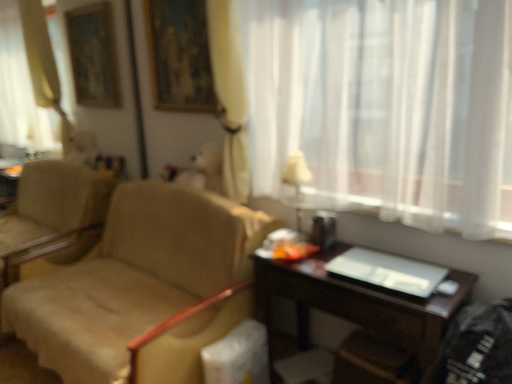
What do you see at coordinates (372, 105) in the screenshot?
I see `white sheer curtain at upper right` at bounding box center [372, 105].

This screenshot has height=384, width=512. I want to click on dark wood desk at lower right, so click(356, 301).

What do you see at coordinates (356, 301) in the screenshot?
I see `dark wood desk at lower right` at bounding box center [356, 301].

I want to click on white plastic laptop at right, so click(x=388, y=272).

In order to face white fabric lampshade at upper center, should I rotate leftwards or rightwards?

Turn right by 5.519 degrees to look at white fabric lampshade at upper center.

What are the coordinates of `beige fabric chair at left` in the screenshot? It's located at (142, 287).

Is point (294, 152) positioned behind point (157, 78)?

No, it is not.

This screenshot has width=512, height=384. In order to click on table lamp below the wooden picture frame at upper center (from a real-world perspective) in this screenshot , I will do `click(297, 171)`.

Can you tell me how much white fabric lampshade at upper center and wooden picture frame at upper center differ in facing direction?

The facing directions of white fabric lampshade at upper center and wooden picture frame at upper center are 0.904 degrees apart.

Which is behind, white plastic laptop at right or beige fabric chair at left?

white plastic laptop at right is further away from the camera.

Considering the relative sizes of white plastic laptop at right and beige fabric chair at left in the image provided, is white plastic laptop at right wider than beige fabric chair at left?

Incorrect, the width of white plastic laptop at right does not surpass that of beige fabric chair at left.

Is white plastic laptop at right positioned with its back to beige fabric chair at left?

No, beige fabric chair at left is not at the back of white plastic laptop at right.

Does point (432, 281) come in front of point (144, 286)?

Yes, it is.

Considering the relative sizes of dark wood desk at lower right and white fabric lampshade at upper center in the image provided, is dark wood desk at lower right taller than white fabric lampshade at upper center?

Yes, dark wood desk at lower right is taller than white fabric lampshade at upper center.

Looking at this image, from the image's perspective, is dark wood desk at lower right located above white fabric lampshade at upper center?

Incorrect, from the image's perspective, dark wood desk at lower right is lower than white fabric lampshade at upper center.

Between dark wood desk at lower right and white fabric lampshade at upper center, which one has smaller width?

white fabric lampshade at upper center.

Would you consider dark wood desk at lower right to be distant from white fabric lampshade at upper center?

They are positioned close to each other.

Is white plastic laptop at right turned away from wooden picture frame at upper center?

That's not correct — white plastic laptop at right is not looking away from wooden picture frame at upper center.

The width and height of the screenshot is (512, 384). In the image, there is a wooden picture frame at upper center. Find the location of `laptop below it (from the image's perspective)`. laptop below it (from the image's perspective) is located at coordinates (388, 272).

Is white plastic laptop at right taller or shorter than wooden picture frame at upper center?

Clearly, white plastic laptop at right is shorter compared to wooden picture frame at upper center.

Is white plastic laptop at right positioned beyond the bounds of wooden picture frame at upper center?

Yes.

Choose the correct answer: Is white fabric lampshade at upper center inside dark wood desk at lower right or outside it?

white fabric lampshade at upper center is not inside dark wood desk at lower right, it's outside.

Measure the distance between white fabric lampshade at upper center and dark wood desk at lower right.

white fabric lampshade at upper center is 21.17 inches away from dark wood desk at lower right.

From the image's perspective, is white fabric lampshade at upper center beneath dark wood desk at lower right?

Actually, white fabric lampshade at upper center appears above dark wood desk at lower right in the image.

This screenshot has width=512, height=384. What are the coordinates of `table lamp above the dark wood desk at lower right (from a real-world perspective)` in the screenshot? It's located at (297, 171).

Who is smaller, white sheer curtain at upper right or dark wood desk at lower right?

Smaller between the two is dark wood desk at lower right.

Consider the image. In terms of width, does white sheer curtain at upper right look wider or thinner when compared to dark wood desk at lower right?

In the image, white sheer curtain at upper right appears to be more narrow than dark wood desk at lower right.

Is white sheer curtain at upper right not near dark wood desk at lower right?

No, white sheer curtain at upper right is not far away from dark wood desk at lower right.

From the picture: Is dark wood desk at lower right a part of white sheer curtain at upper right?

No, white sheer curtain at upper right does not contain dark wood desk at lower right.

From a real-world perspective, is white sheer curtain at upper right physically below white plastic laptop at right?

Actually, white sheer curtain at upper right is physically above white plastic laptop at right in the real world.

Which is correct: white sheer curtain at upper right is inside white plastic laptop at right, or outside of it?

white sheer curtain at upper right exists outside the volume of white plastic laptop at right.

Is the position of white sheer curtain at upper right less distant than that of white plastic laptop at right?

Yes, it is in front of white plastic laptop at right.

Does white sheer curtain at upper right have a greater height compared to white plastic laptop at right?

Yes, white sheer curtain at upper right is taller than white plastic laptop at right.

Locate an element on the screen. picture frame that appears above the white fabric lampshade at upper center (from the image's perspective) is located at coordinates (179, 55).

Identify the location of chair on the left side of white plastic laptop at right. (142, 287).

From the picture: Which object lies nearer to the anchor point white fabric lampshade at upper center, white sheer curtain at upper right or dark wood desk at lower right?

The object closer to white fabric lampshade at upper center is white sheer curtain at upper right.

Estimate the real-world distances between objects in this image. Which object is closer to dark wood desk at lower right, white plastic laptop at right or white fabric lampshade at upper center?

Among the two, white plastic laptop at right is located nearer to dark wood desk at lower right.

From the image, which object appears to be farther from beige fabric chair at left, white plastic laptop at right or dark wood desk at lower right?

white plastic laptop at right is positioned further to the anchor beige fabric chair at left.

From the image, which object appears to be nearer to beige fabric chair at left, white sheer curtain at upper right or white fabric lampshade at upper center?

white sheer curtain at upper right is closer to beige fabric chair at left.

Considering their positions, is wooden picture frame at upper center positioned closer to dark wood desk at lower right than white fabric lampshade at upper center?

Based on the image, white fabric lampshade at upper center appears to be nearer to dark wood desk at lower right.

Looking at the image, which one is located further to white plastic laptop at right, dark wood desk at lower right or wooden picture frame at upper center?

wooden picture frame at upper center lies further to white plastic laptop at right than the other object.

Which object lies nearer to the anchor point beige fabric chair at left, wooden picture frame at upper center or white fabric lampshade at upper center?

Among the two, white fabric lampshade at upper center is located nearer to beige fabric chair at left.

Looking at the image, which one is located further to beige fabric chair at left, white fabric lampshade at upper center or wooden picture frame at upper center?

wooden picture frame at upper center is further to beige fabric chair at left.

The image size is (512, 384). Find the location of `table lamp between wooden picture frame at upper center and beige fabric chair at left in the up-down direction`. table lamp between wooden picture frame at upper center and beige fabric chair at left in the up-down direction is located at coordinates (297, 171).

This screenshot has height=384, width=512. Find the location of `laptop that lies between white sheer curtain at upper right and dark wood desk at lower right from top to bottom`. laptop that lies between white sheer curtain at upper right and dark wood desk at lower right from top to bottom is located at coordinates (388, 272).

Identify the location of table lamp between white sheer curtain at upper right and wooden picture frame at upper center from front to back. (297, 171).

At what (x,y) coordinates should I click in order to perform the action: click on table lamp between white sheer curtain at upper right and dark wood desk at lower right in the vertical direction. Please return your answer as a coordinate pair (x, y). Image resolution: width=512 pixels, height=384 pixels. Looking at the image, I should click on [297, 171].